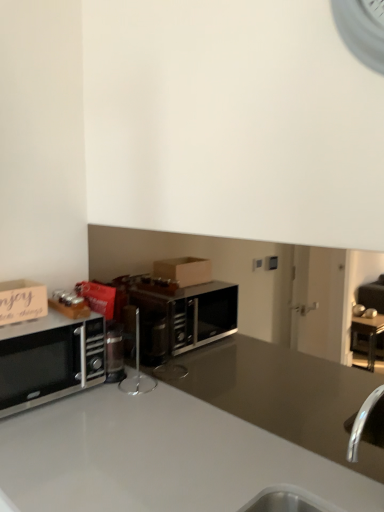
Image resolution: width=384 pixels, height=512 pixels. What are the coordinates of `satin silver stand at center` in the screenshot? It's located at (137, 371).

Find the location of a particular element. satin black microwave at left is located at coordinates (49, 360).

How many degrees apart are the facing directions of satin silver stand at center and satin black microwave at left?

The angular difference between satin silver stand at center and satin black microwave at left is 90 degrees.

Can you confirm if satin silver stand at center is wider than satin black microwave at left?

No.

Is satin silver stand at center spatially inside satin black microwave at left, or outside of it?

satin silver stand at center is not enclosed by satin black microwave at left.

Considering the positions of objects satin silver stand at center and satin black microwave at left in the image provided, who is behind, satin silver stand at center or satin black microwave at left?

satin silver stand at center is behind.

Could satin silver stand at center be considered to be inside wooden sign at left?

No, satin silver stand at center is located outside of wooden sign at left.

How distant is wooden sign at left from satin silver stand at center?

wooden sign at left and satin silver stand at center are 16.82 inches apart.

Find the location of a particular element. Image resolution: width=384 pixels, height=512 pixels. cabinetry above the satin silver stand at center (from the image's perspective) is located at coordinates (22, 301).

Considering the sizes of objects wooden sign at left and satin silver stand at center in the image provided, who is smaller, wooden sign at left or satin silver stand at center?

satin silver stand at center.

Who is taller, satin silver stand at center or wooden sign at left?

With more height is satin silver stand at center.

Considering the relative sizes of satin silver stand at center and wooden sign at left in the image provided, is satin silver stand at center smaller than wooden sign at left?

Correct, satin silver stand at center occupies less space than wooden sign at left.

Measure the distance between satin silver stand at center and wooden sign at left.

The distance of satin silver stand at center from wooden sign at left is 16.82 inches.

From a real-world perspective, between satin silver stand at center and wooden sign at left, who is vertically lower?

satin silver stand at center, from a real-world perspective.

Between satin black microwave at left and wooden sign at left, which one has smaller size?

With smaller size is wooden sign at left.

From the image's perspective, is satin black microwave at left beneath wooden sign at left?

Yes, from the image's perspective, satin black microwave at left is below wooden sign at left.

Is satin black microwave at left next to wooden sign at left?

satin black microwave at left and wooden sign at left are not in contact.

Is satin black microwave at left looking in the opposite direction of wooden sign at left?

No, satin black microwave at left's orientation is not away from wooden sign at left.

Is wooden sign at left further to the viewer compared to satin black microwave at left?

Yes, wooden sign at left is further from the camera.

The height and width of the screenshot is (512, 384). I want to click on microwave oven on the right of wooden sign at left, so click(49, 360).

Is wooden sign at left next to satin black microwave at left?

wooden sign at left and satin black microwave at left are not in contact.

From the image's perspective, is wooden sign at left over satin black microwave at left?

Yes.

Is satin black microwave at left further to the viewer compared to satin silver stand at center?

No, satin black microwave at left is in front of satin silver stand at center.

From the image's perspective, is satin black microwave at left located above satin silver stand at center?

No, from the image's perspective, satin black microwave at left is not over satin silver stand at center.

Does satin black microwave at left have a greater width compared to satin silver stand at center?

Correct, the width of satin black microwave at left exceeds that of satin silver stand at center.

Is satin black microwave at left surrounding satin silver stand at center?

No, satin silver stand at center is not inside satin black microwave at left.

I want to click on microwave oven to the left of satin silver stand at center, so click(x=49, y=360).

Find the location of a particular element. The height and width of the screenshot is (512, 384). appliance that is behind the wooden sign at left is located at coordinates [x=137, y=371].

Considering their positions, is wooden sign at left positioned closer to satin silver stand at center than satin black microwave at left?

satin black microwave at left.

Which object lies nearer to the anchor point satin black microwave at left, satin silver stand at center or wooden sign at left?

The object closer to satin black microwave at left is wooden sign at left.

Estimate the real-world distances between objects in this image. Which object is closer to wooden sign at left, satin black microwave at left or satin silver stand at center?

Based on the image, satin black microwave at left appears to be nearer to wooden sign at left.

Which object lies further to the anchor point satin silver stand at center, satin black microwave at left or wooden sign at left?

wooden sign at left lies further to satin silver stand at center than the other object.

Estimate the real-world distances between objects in this image. Which object is further from satin black microwave at left, wooden sign at left or satin silver stand at center?

satin silver stand at center is further to satin black microwave at left.

Which object lies further to the anchor point wooden sign at left, satin silver stand at center or satin black microwave at left?

satin silver stand at center lies further to wooden sign at left than the other object.

This screenshot has width=384, height=512. Identify the location of microwave oven between wooden sign at left and satin silver stand at center from left to right. (49, 360).